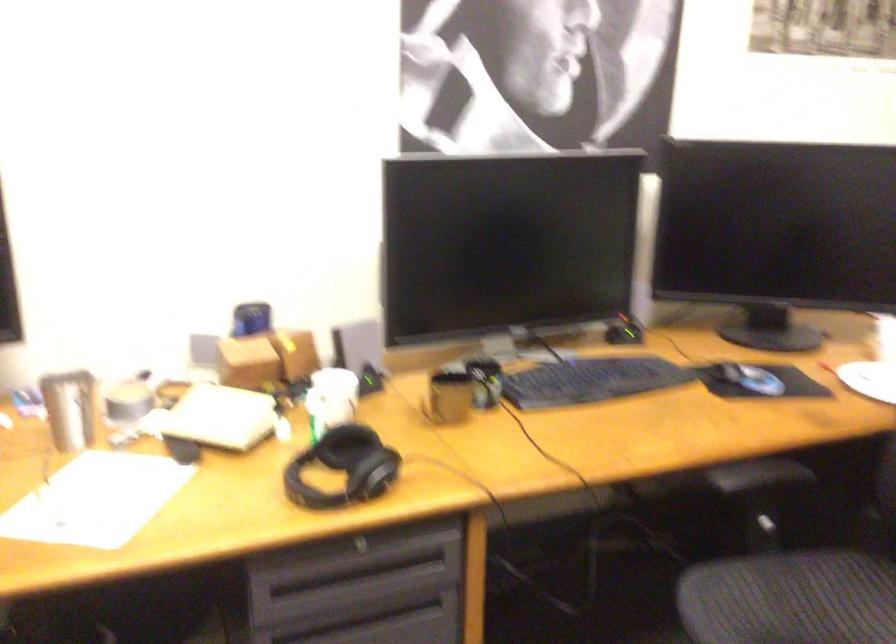
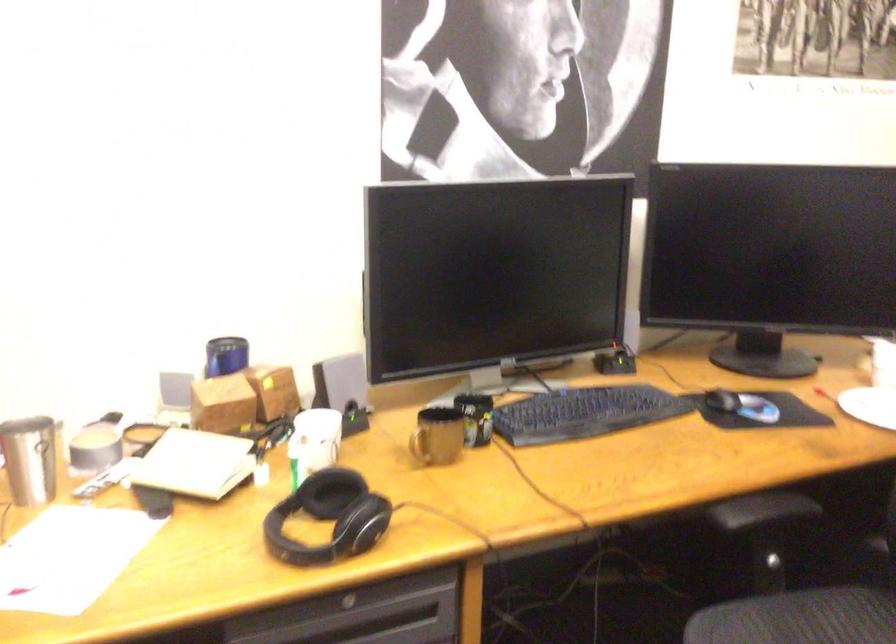
In the second image, find the point that corresponds to (341,469) in the first image.

(329, 518)